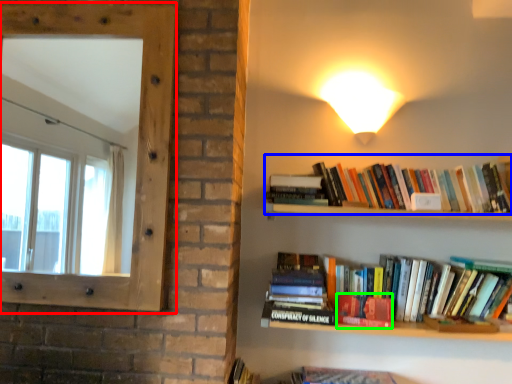
Question: Which object is positioned farthest from window screen (highlighted by a red box)? Select from book (highlighted by a blue box) and paperback book (highlighted by a green box).

Choices:
 (A) book
 (B) paperback book

Answer: (B)